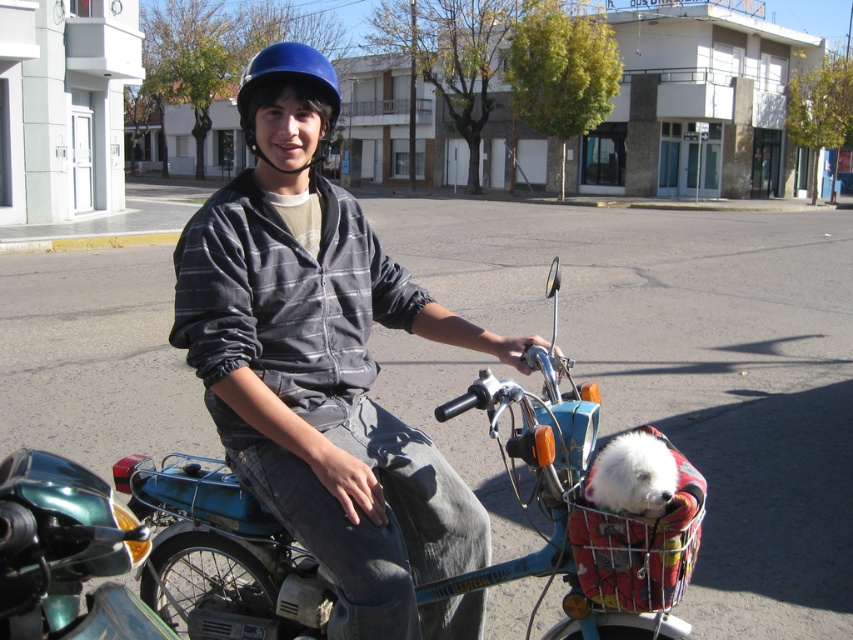
Question: Considering the relative positions of blue metallic motorcycle at center and blue matte helmet at center in the image provided, where is blue metallic motorcycle at center located with respect to blue matte helmet at center?

Choices:
 (A) above
 (B) below

Answer: (B)

Question: Does matte blue helmet at center appear over blue metallic motorcycle at center?

Choices:
 (A) yes
 (B) no

Answer: (A)

Question: Based on their relative distances, which object is nearer to the matte blue helmet at center?

Choices:
 (A) blue metallic motorcycle at center
 (B) blue matte helmet at center

Answer: (A)

Question: Which point is closer to the camera?

Choices:
 (A) blue metallic motorcycle at center
 (B) matte blue helmet at center

Answer: (B)

Question: Does matte blue helmet at center appear over blue matte helmet at center?

Choices:
 (A) no
 (B) yes

Answer: (A)

Question: Which object is positioned closest to the matte blue helmet at center?

Choices:
 (A) blue matte helmet at center
 (B) blue metallic motorcycle at center

Answer: (B)